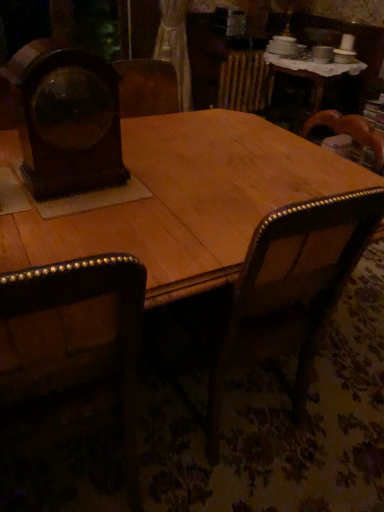
Question: From the image's perspective, is wooden armchair at center above or below dark brown leather chair at left?

Choices:
 (A) above
 (B) below

Answer: (A)

Question: Looking at the image, does wooden armchair at center seem bigger or smaller compared to dark brown leather chair at left?

Choices:
 (A) big
 (B) small

Answer: (A)

Question: Based on their relative distances, which object is nearer to the wooden clock at left?

Choices:
 (A) dark brown leather chair at left
 (B) wooden armchair at center

Answer: (A)

Question: Estimate the real-world distances between objects in this image. Which object is closer to the wooden armchair at center?

Choices:
 (A) wooden clock at left
 (B) dark brown leather chair at left

Answer: (B)